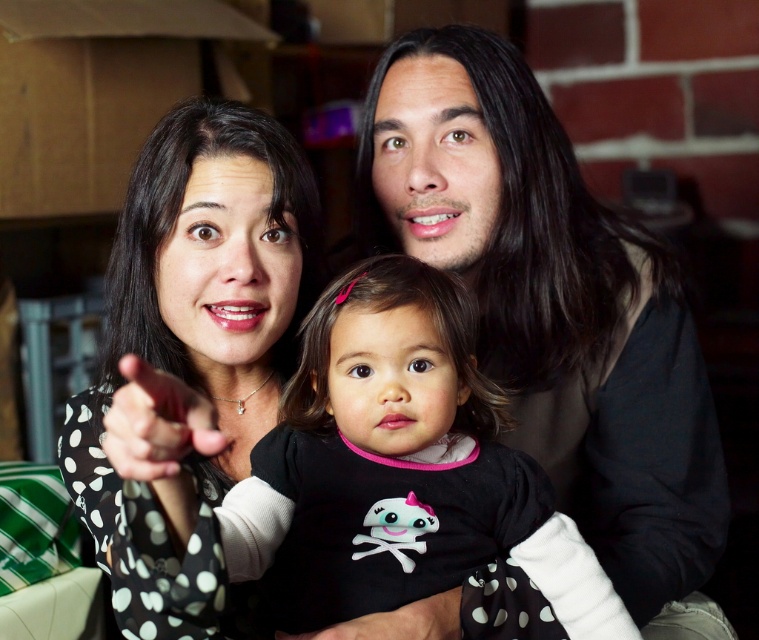
You are a photographer setting up for a family photo. You need to ensure that the black polka dot onesie at center and the black dotted shirt at center are both visible in the frame. Based on their heights, which one might require you to adjust your camera angle to avoid being cut off?

The black polka dot onesie at center has a lesser height compared to the black dotted shirt at center, so the black polka dot onesie at center might require adjusting the camera angle to ensure it is fully visible in the frame.